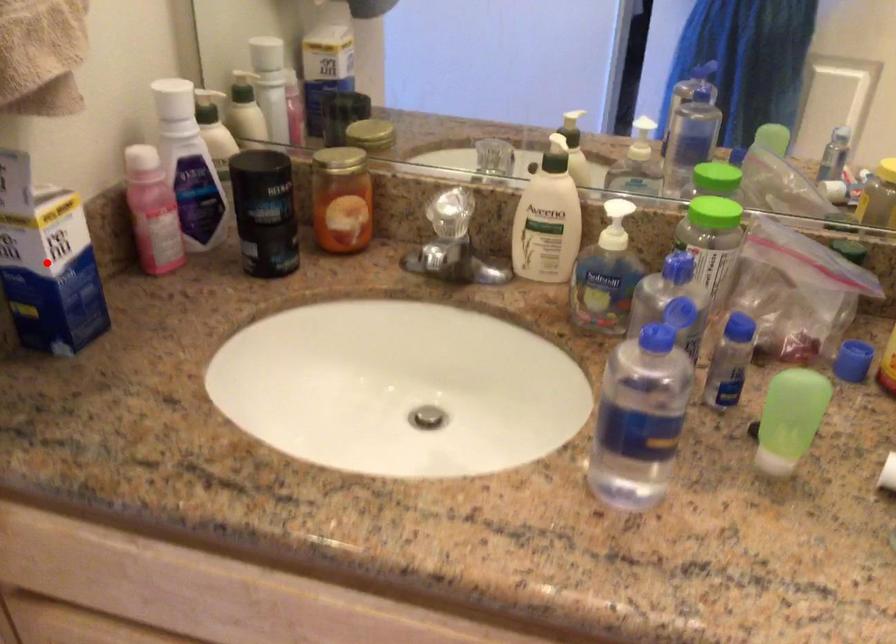
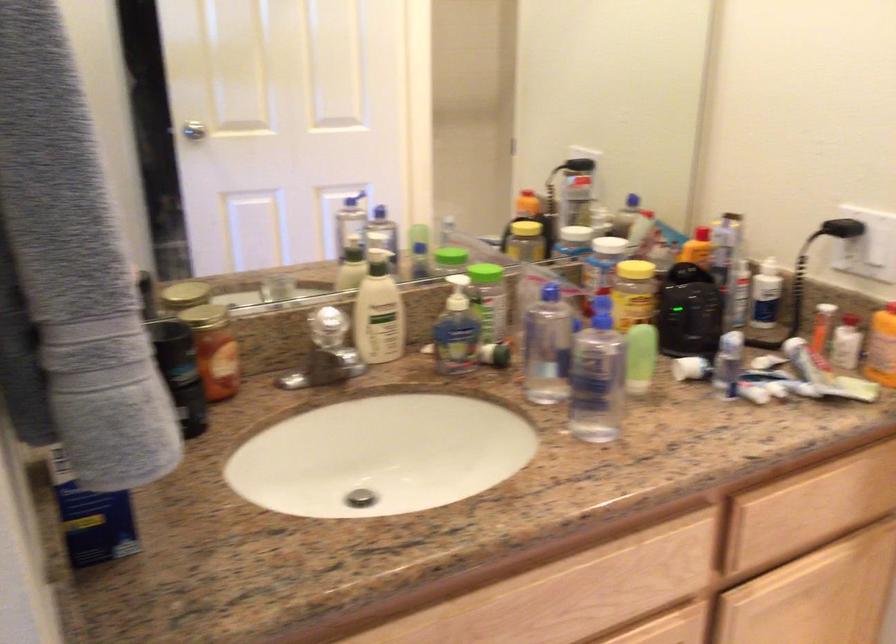
Question: I am providing you with two images of the same scene from different viewpoints. A red point is marked on the first image. At the location where the point appears in image 1, is it still visible in image 2?

Choices:
 (A) Yes
 (B) No

Answer: (B)